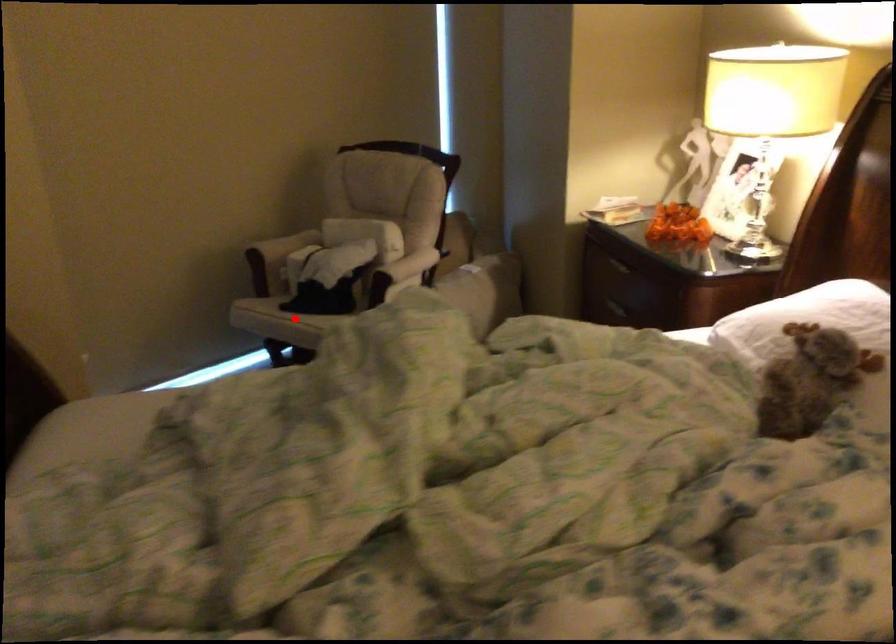
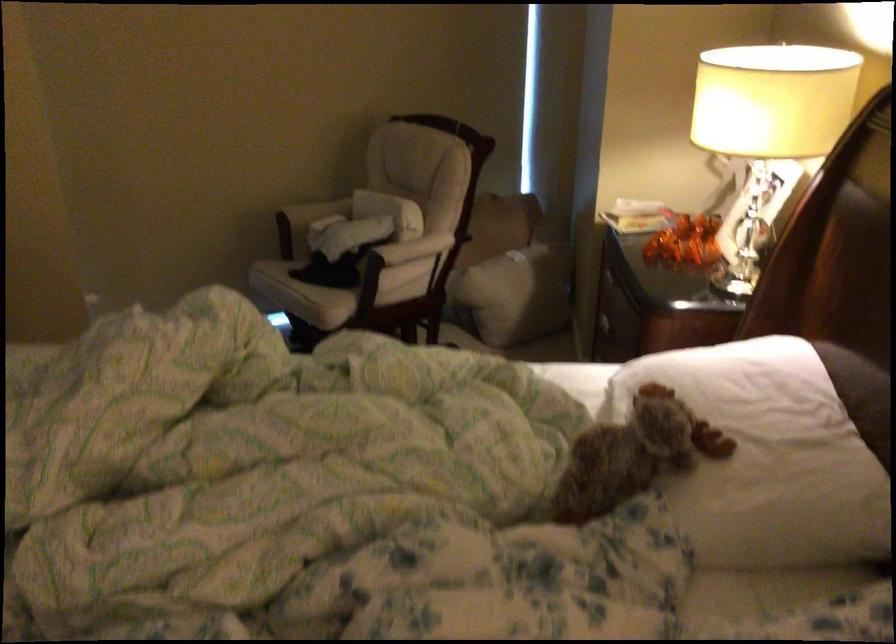
The point at the highlighted location is marked in the first image. Where is the corresponding point in the second image?

(291, 285)